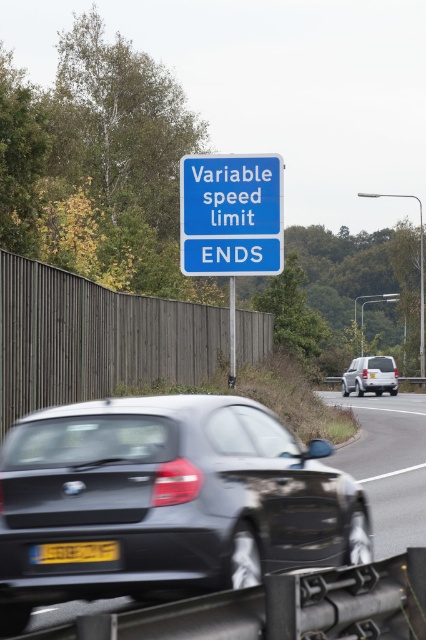
Question: Does yellow plastic license plate at lower center appear over white matte suv at center?

Choices:
 (A) no
 (B) yes

Answer: (B)

Question: Does matte black car at center have a greater width compared to yellow plastic license plate at lower center?

Choices:
 (A) yes
 (B) no

Answer: (A)

Question: Among these objects, which one is farthest from the camera?

Choices:
 (A) yellow plastic license plate at lower center
 (B) white matte suv at center
 (C) matte black car at center

Answer: (B)

Question: Which point is closer to the camera?

Choices:
 (A) (2, 472)
 (B) (112, 545)
 (C) (233, 218)
 (D) (348, 376)

Answer: (B)

Question: Does matte black car at center have a larger size compared to yellow plastic license plate at lower center?

Choices:
 (A) no
 (B) yes

Answer: (B)

Question: Which point is farther from the camera taking this photo?

Choices:
 (A) (86, 588)
 (B) (80, 557)
 (C) (253, 205)
 (D) (374, 355)

Answer: (D)